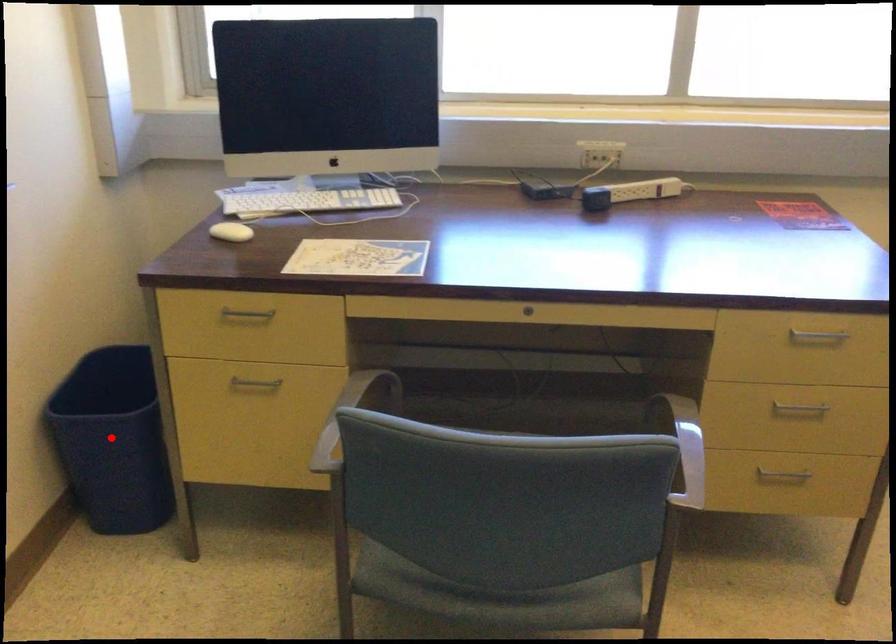
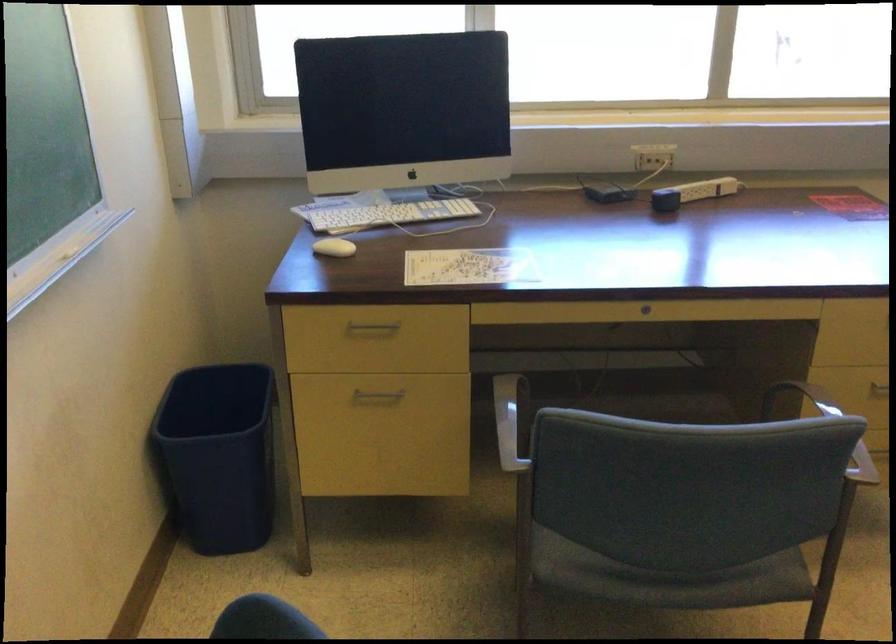
The point at the highlighted location is marked in the first image. Where is the corresponding point in the second image?

(217, 456)